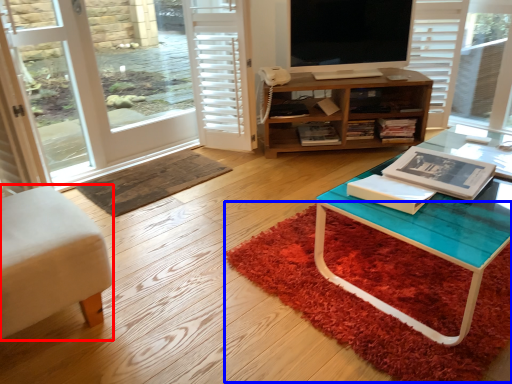
Question: Which point is closer to the camera, chair (highlighted by a red box) or doormat (highlighted by a blue box)?

Choices:
 (A) chair
 (B) doormat

Answer: (A)